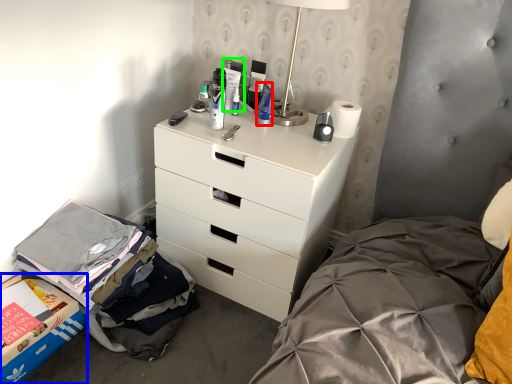
Question: Which is nearer to the toiletry (highlighted by a red box)? storage box (highlighted by a blue box) or toiletry (highlighted by a green box).

Choices:
 (A) storage box
 (B) toiletry

Answer: (B)